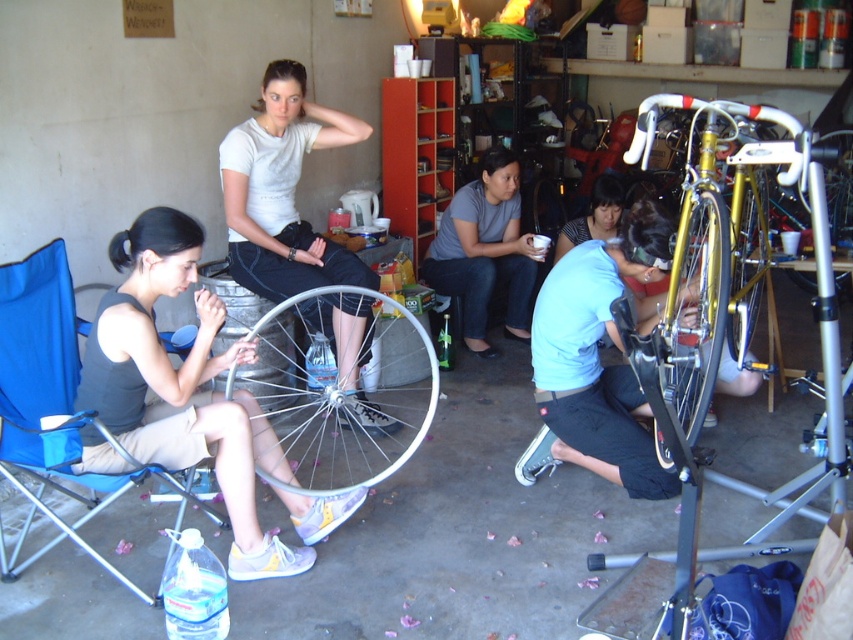
Question: Estimate the real-world distances between objects in this image. Which object is closer to the gold metallic bicycle wheel at right?

Choices:
 (A) gold metallic bicycle wheel at center right
 (B) silver metallic bicycle wheel at center
 (C) matte gray tank top at lower left
 (D) blue fabric folding chair at lower left

Answer: (A)

Question: Among these points, which one is nearest to the camera?

Choices:
 (A) (817, 208)
 (B) (32, 355)
 (C) (285, 438)
 (D) (360, 330)

Answer: (A)

Question: Is gold metallic bicycle at center right above gold metallic bicycle wheel at right?

Choices:
 (A) no
 (B) yes

Answer: (A)

Question: Observing the image, what is the correct spatial positioning of matte gray tank top at lower left in reference to gold metallic bicycle at center right?

Choices:
 (A) left
 (B) right

Answer: (A)

Question: Does blue fabric folding chair at lower left lie in front of gold metallic bicycle wheel at center right?

Choices:
 (A) yes
 (B) no

Answer: (B)

Question: Considering the real-world distances, which object is farthest from the matte gray shirt at center?

Choices:
 (A) white matte shirt at upper center
 (B) gold metallic bicycle at center right

Answer: (B)